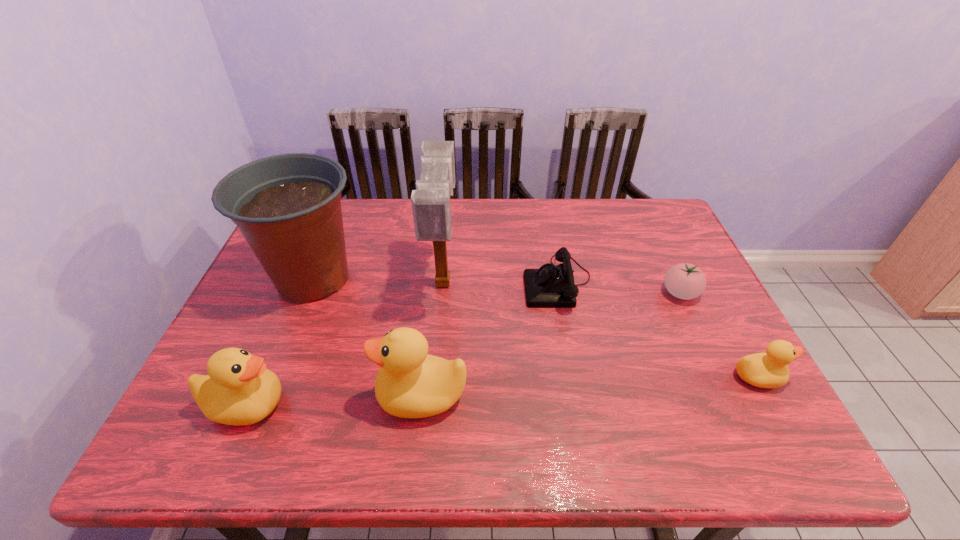
You are a GUI agent. You are given a task and a screenshot of the screen. Output one action in this format:
    pyautogui.click(x=<x>, y=<y>)
    Task: Click on the blank region between the fourth shortest object and the mallet
    This screenshot has width=960, height=540.
    Given the screenshot: What is the action you would take?
    pyautogui.click(x=345, y=343)

I want to click on free space between the second duck from right to left and the tomato, so click(551, 344).

The height and width of the screenshot is (540, 960). In order to click on free space between the fifth object from left to right and the shortest duck in this screenshot , I will do `click(658, 329)`.

At what (x,y) coordinates should I click in order to perform the action: click on vacant area between the telephone and the mallet. Please return your answer as a coordinate pair (x, y). Looking at the image, I should click on (500, 282).

Locate an element on the screen. Image resolution: width=960 pixels, height=540 pixels. vacant area that lies between the tomato and the second duck from left to right is located at coordinates click(551, 344).

This screenshot has width=960, height=540. Identify the location of vacant space in between the second shortest duck and the shortest duck. (501, 391).

Where is `vacant point located between the tomato and the leftmost duck`? This screenshot has width=960, height=540. vacant point located between the tomato and the leftmost duck is located at coordinates (463, 349).

Identify which object is located as the fifth nearest to the telephone. Please provide its 2D coordinates. Your answer should be formatted as a tuple, i.e. [(x, y)], where the tuple contains the x and y coordinates of a point satisfying the conditions above.

[(288, 208)]

Where is `object that stands as the fifth closest to the flowerpot`? object that stands as the fifth closest to the flowerpot is located at coordinates pos(686,281).

Where is `the second closest duck relative to the third object from right to left`? This screenshot has height=540, width=960. the second closest duck relative to the third object from right to left is located at coordinates (764, 370).